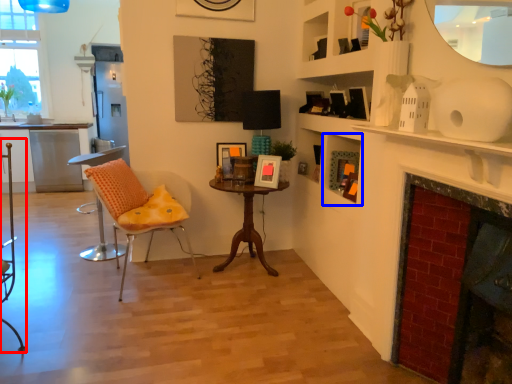
Question: Among these objects, which one is farthest to the camera, armchair (highlighted by a red box) or shelf (highlighted by a blue box)?

Choices:
 (A) armchair
 (B) shelf

Answer: (B)